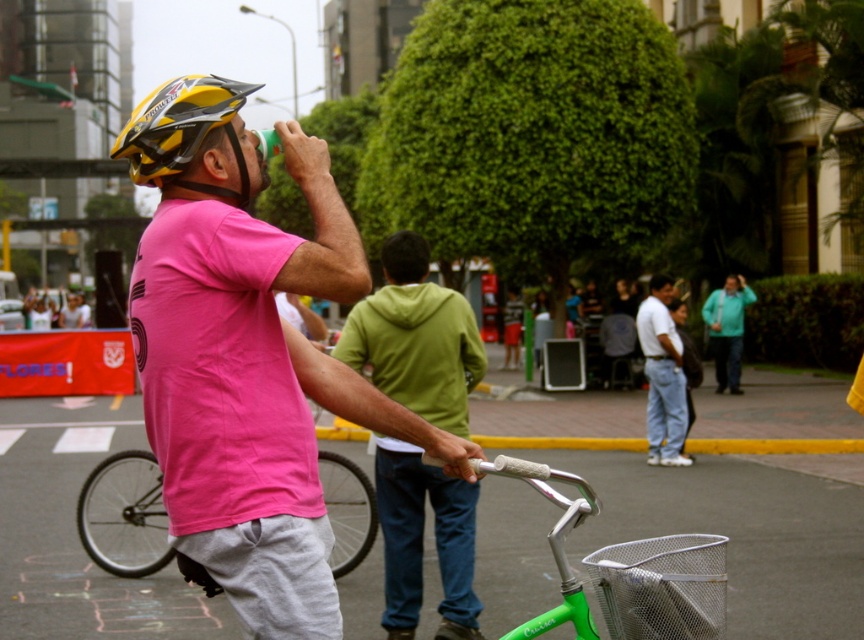
Consider the image. Who is lower down, green matte bicycle at center or white cotton shirt at center?

green matte bicycle at center is lower down.

Is green matte bicycle at center thinner than white cotton shirt at center?

No.

Who is more forward, (344, 554) or (677, 388)?

Point (344, 554)

This screenshot has height=640, width=864. Find the location of `green matte bicycle at center`. green matte bicycle at center is located at coordinates (124, 515).

Does point (81, 500) come in front of point (156, 166)?

No.

Where is `green matte bicycle at center`? The width and height of the screenshot is (864, 640). green matte bicycle at center is located at coordinates (124, 515).

Does point (402, 484) come closer to viewer compared to point (113, 556)?

Yes, point (402, 484) is closer to viewer.

Describe the element at coordinates (415, 339) in the screenshot. The width and height of the screenshot is (864, 640). I see `green matte hoodie at center` at that location.

Locate an element on the screen. This screenshot has height=640, width=864. green matte hoodie at center is located at coordinates (415, 339).